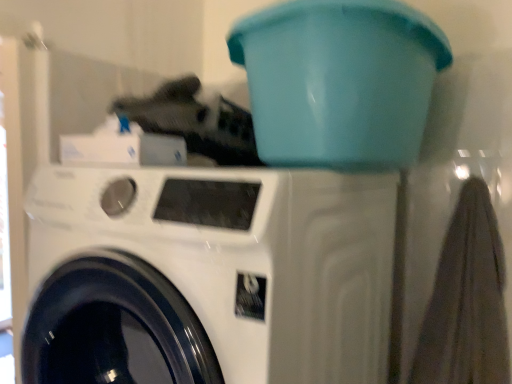
Image resolution: width=512 pixels, height=384 pixels. In order to click on teal plastic bucket at upper center in this screenshot , I will do `click(339, 81)`.

Describe the element at coordinates (339, 81) in the screenshot. I see `teal plastic bucket at upper center` at that location.

This screenshot has height=384, width=512. Describe the element at coordinates (208, 275) in the screenshot. I see `white glossy washing machine at center` at that location.

Where is `white glossy washing machine at center`? white glossy washing machine at center is located at coordinates (208, 275).

This screenshot has width=512, height=384. What are the coordinates of `teal plastic bucket at upper center` in the screenshot? It's located at (339, 81).

Between teal plastic bucket at upper center and white glossy washing machine at center, which one appears on the right side from the viewer's perspective?

teal plastic bucket at upper center.

Which object is closer to the camera, teal plastic bucket at upper center or white glossy washing machine at center?

white glossy washing machine at center is more forward.

Is point (426, 69) positioned in front of point (354, 349)?

Yes, point (426, 69) is in front of point (354, 349).

From the image's perspective, is teal plastic bucket at upper center located beneath white glossy washing machine at center?

No, from the image's perspective, teal plastic bucket at upper center is not beneath white glossy washing machine at center.

From a real-world perspective, relative to white glossy washing machine at center, is teal plastic bucket at upper center vertically above or below?

teal plastic bucket at upper center is above white glossy washing machine at center.

Can you confirm if teal plastic bucket at upper center is wider than white glossy washing machine at center?

No.

Is teal plastic bucket at upper center taller or shorter than white glossy washing machine at center?

Clearly, teal plastic bucket at upper center is shorter compared to white glossy washing machine at center.

Considering the relative sizes of teal plastic bucket at upper center and white glossy washing machine at center in the image provided, is teal plastic bucket at upper center bigger than white glossy washing machine at center?

Incorrect, teal plastic bucket at upper center is not larger than white glossy washing machine at center.

Is white glossy washing machine at center inside teal plastic bucket at upper center?

No, teal plastic bucket at upper center does not contain white glossy washing machine at center.

Are teal plastic bucket at upper center and white glossy washing machine at center making contact?

teal plastic bucket at upper center and white glossy washing machine at center are not in contact.

Consider the image. Is white glossy washing machine at center at the back of teal plastic bucket at upper center?

teal plastic bucket at upper center does not have its back to white glossy washing machine at center.

The height and width of the screenshot is (384, 512). I want to click on water cooler behind the white glossy washing machine at center, so click(339, 81).

Which is more to the left, white glossy washing machine at center or teal plastic bucket at upper center?

Positioned to the left is white glossy washing machine at center.

Is white glossy washing machine at center positioned in front of teal plastic bucket at upper center?

Yes, it is in front of teal plastic bucket at upper center.

Which is behind, point (161, 318) or point (293, 156)?

The point (293, 156) is behind.

From the image's perspective, is white glossy washing machine at center above teal plastic bucket at upper center?

No, from the image's perspective, white glossy washing machine at center is not on top of teal plastic bucket at upper center.

From a real-world perspective, which object rests below the other?

In real-world perspective, white glossy washing machine at center is lower.

Is white glossy washing machine at center wider than teal plastic bucket at upper center?

Indeed, white glossy washing machine at center has a greater width compared to teal plastic bucket at upper center.

Who is shorter, white glossy washing machine at center or teal plastic bucket at upper center?

With less height is teal plastic bucket at upper center.

Considering the sizes of objects white glossy washing machine at center and teal plastic bucket at upper center in the image provided, who is bigger, white glossy washing machine at center or teal plastic bucket at upper center?

With larger size is white glossy washing machine at center.

Do you think white glossy washing machine at center is within teal plastic bucket at upper center, or outside of it?

white glossy washing machine at center is not inside teal plastic bucket at upper center, it's outside.

Is white glossy washing machine at center far away from teal plastic bucket at upper center?

No, there isn't a large distance between white glossy washing machine at center and teal plastic bucket at upper center.

Is white glossy washing machine at center facing away from teal plastic bucket at upper center?

No, white glossy washing machine at center is not facing away from teal plastic bucket at upper center.

You are a GUI agent. You are given a task and a screenshot of the screen. Output one action in this format:
    pyautogui.click(x=<x>, y=<y>)
    Task: Click on the washing machine below the teal plastic bucket at upper center (from a real-world perspective)
    The width and height of the screenshot is (512, 384).
    Given the screenshot: What is the action you would take?
    pyautogui.click(x=208, y=275)

Image resolution: width=512 pixels, height=384 pixels. I want to click on washing machine to the left of teal plastic bucket at upper center, so click(x=208, y=275).

There is a white glossy washing machine at center. What are the coordinates of `water cooler above it (from a real-world perspective)` in the screenshot? It's located at (339, 81).